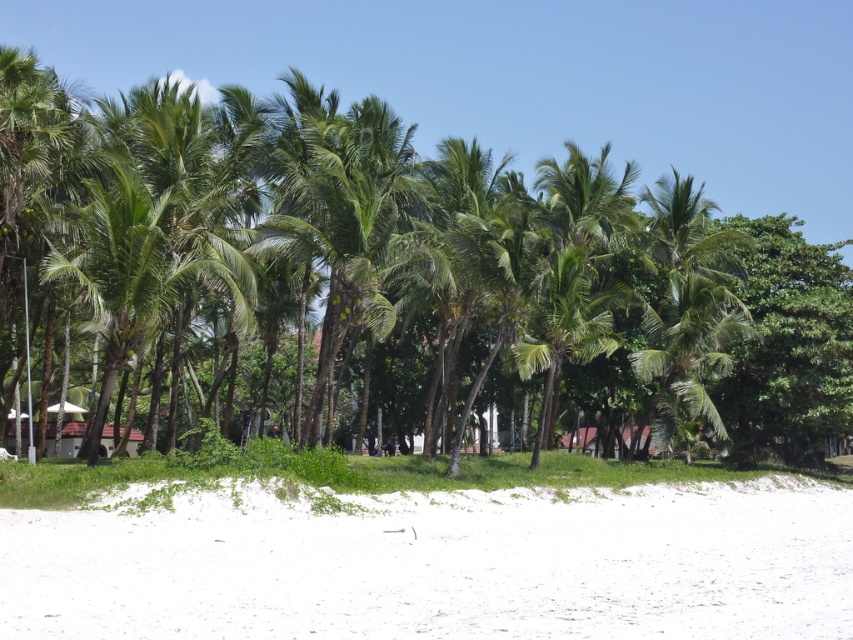
You are standing on the beach and want to take a photo of both the palm trees and the resort buildings in the background. Which point, point (115, 305) or point (691, 342), should you focus on to ensure both the palm trees and the resort buildings are in focus?

You should focus on point (691, 342) because it is further away from the camera than point (115, 305). This will ensure that both the closer palm trees and the distant resort buildings are within the depth of field and appear sharp in the photo.